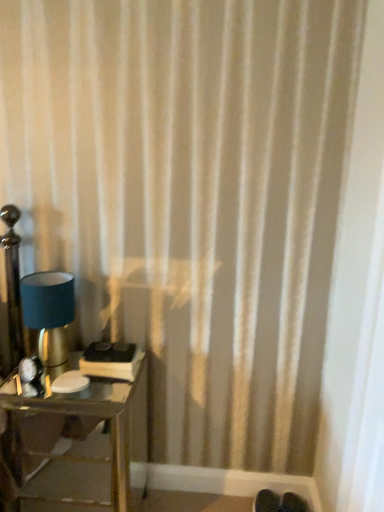
Image resolution: width=384 pixels, height=512 pixels. Identify the location of matte blue fabric lampshade at left. (49, 313).

What do you see at coordinates (49, 313) in the screenshot? I see `matte blue fabric lampshade at left` at bounding box center [49, 313].

Image resolution: width=384 pixels, height=512 pixels. What do you see at coordinates (75, 444) in the screenshot?
I see `metallic glass table at lower left` at bounding box center [75, 444].

The image size is (384, 512). Find the location of `metallic glass table at lower left`. metallic glass table at lower left is located at coordinates (75, 444).

Image resolution: width=384 pixels, height=512 pixels. Identify the location of matte blue fabric lampshade at left. 49,313.

Can you confirm if matte blue fabric lampshade at left is positioned to the left of metallic glass table at lower left?

Yes.

Is matte blue fabric lampshade at left further to the viewer compared to metallic glass table at lower left?

Yes, it is behind metallic glass table at lower left.

Is point (46, 334) less distant than point (12, 456)?

Yes, it is in front of point (12, 456).

From the image's perspective, is matte blue fabric lampshade at left positioned above or below metallic glass table at lower left?

matte blue fabric lampshade at left is situated higher than metallic glass table at lower left in the image.

From a real-world perspective, is matte blue fabric lampshade at left beneath metallic glass table at lower left?

No.

Considering the relative sizes of matte blue fabric lampshade at left and metallic glass table at lower left in the image provided, is matte blue fabric lampshade at left thinner than metallic glass table at lower left?

Yes, matte blue fabric lampshade at left is thinner than metallic glass table at lower left.

Is matte blue fabric lampshade at left taller than metallic glass table at lower left?

No.

Is matte blue fabric lampshade at left smaller than metallic glass table at lower left?

Indeed, matte blue fabric lampshade at left has a smaller size compared to metallic glass table at lower left.

Do you think matte blue fabric lampshade at left is within metallic glass table at lower left, or outside of it?

The correct answer is: outside.

Is matte blue fabric lampshade at left with metallic glass table at lower left?

matte blue fabric lampshade at left is not next to metallic glass table at lower left, and they're not touching.

Is matte blue fabric lampshade at left facing away from metallic glass table at lower left?

matte blue fabric lampshade at left is not turned away from metallic glass table at lower left.

How many degrees apart are the facing directions of matte blue fabric lampshade at left and metallic glass table at lower left?

0.000704 degrees separate the facing orientations of matte blue fabric lampshade at left and metallic glass table at lower left.

Image resolution: width=384 pixels, height=512 pixels. In order to click on table below the matte blue fabric lampshade at left (from a real-world perspective) in this screenshot , I will do `click(75, 444)`.

Which is more to the right, metallic glass table at lower left or matte blue fabric lampshade at left?

Positioned to the right is metallic glass table at lower left.

Is metallic glass table at lower left further to camera compared to matte blue fabric lampshade at left?

That is False.

Does point (74, 476) lie behind point (33, 280)?

Yes.

From the image's perspective, does metallic glass table at lower left appear lower than matte blue fabric lampshade at left?

Yes.

From a real-world perspective, is metallic glass table at lower left physically above matte blue fabric lampshade at left?

No, from a real-world perspective, metallic glass table at lower left is not on top of matte blue fabric lampshade at left.

Looking at their sizes, would you say metallic glass table at lower left is wider or thinner than matte blue fabric lampshade at left?

In the image, metallic glass table at lower left appears to be wider than matte blue fabric lampshade at left.

Can you confirm if metallic glass table at lower left is shorter than matte blue fabric lampshade at left?

In fact, metallic glass table at lower left may be taller than matte blue fabric lampshade at left.

Who is bigger, metallic glass table at lower left or matte blue fabric lampshade at left?

metallic glass table at lower left.

In the scene shown: Is metallic glass table at lower left positioned beyond the bounds of matte blue fabric lampshade at left?

Yes, metallic glass table at lower left is not within matte blue fabric lampshade at left.

Would you consider metallic glass table at lower left to be distant from matte blue fabric lampshade at left?

No.

Could you tell me if metallic glass table at lower left is facing matte blue fabric lampshade at left?

No, metallic glass table at lower left does not turn towards matte blue fabric lampshade at left.

What's the angular difference between metallic glass table at lower left and matte blue fabric lampshade at left's facing directions?

metallic glass table at lower left and matte blue fabric lampshade at left are facing 0.000704 degrees away from each other.

Locate an element on the screen. Image resolution: width=384 pixels, height=512 pixels. table below the matte blue fabric lampshade at left (from the image's perspective) is located at coordinates (75, 444).

The image size is (384, 512). What are the coordinates of `lamp above the metallic glass table at lower left (from the image's perspective)` in the screenshot? It's located at (49, 313).

This screenshot has width=384, height=512. What are the coordinates of `table in front of the matte blue fabric lampshade at left` in the screenshot? It's located at (75, 444).